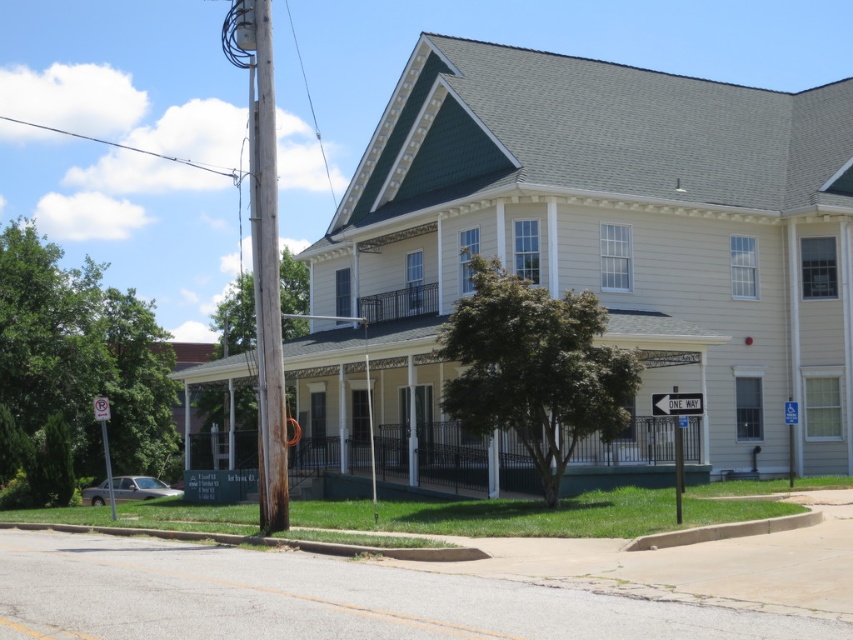
Does yellow siding at center appear over green painted wood porch at center?

Yes, yellow siding at center is above green painted wood porch at center.

Which is behind, point (566, 138) or point (656, 440)?

Point (566, 138)

The height and width of the screenshot is (640, 853). Find the location of `yellow siding at center`. yellow siding at center is located at coordinates (596, 244).

Does point (633, 301) lie in front of point (265, 374)?

No, it is not.

This screenshot has height=640, width=853. Describe the element at coordinates (596, 244) in the screenshot. I see `yellow siding at center` at that location.

Locate an element on the screen. This screenshot has width=853, height=640. yellow siding at center is located at coordinates (596, 244).

Can you confirm if green painted wood porch at center is bigger than brown wooden pole at left?

Correct, green painted wood porch at center is larger in size than brown wooden pole at left.

Is point (465, 480) positioned behind point (270, 465)?

Yes, it is behind point (270, 465).

You are a GUI agent. You are given a task and a screenshot of the screen. Output one action in this format:
    pyautogui.click(x=<x>, y=<y>)
    Task: Click on the green painted wood porch at center
    
    Given the screenshot: What is the action you would take?
    pyautogui.click(x=624, y=458)

Find the location of `green painted wood porch at center`. green painted wood porch at center is located at coordinates (624, 458).